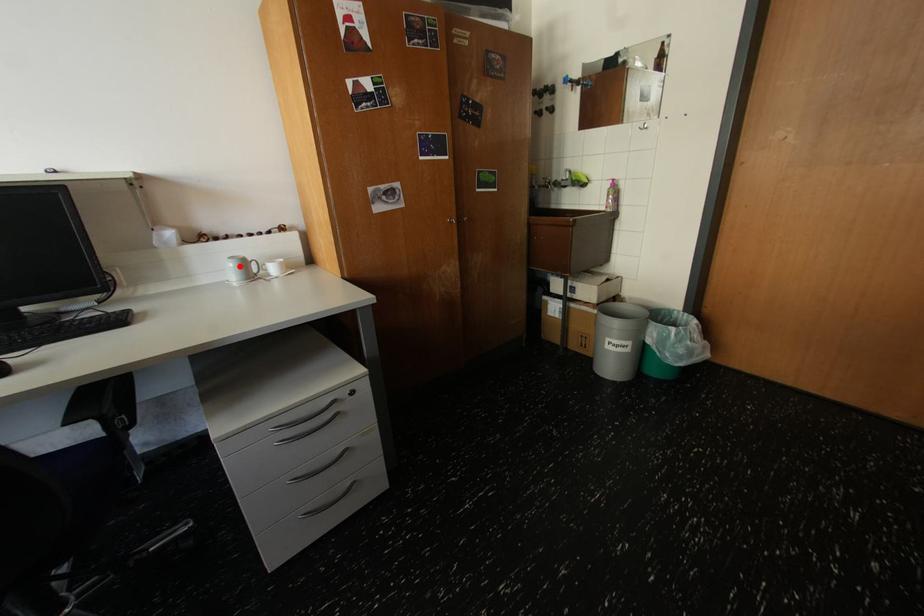
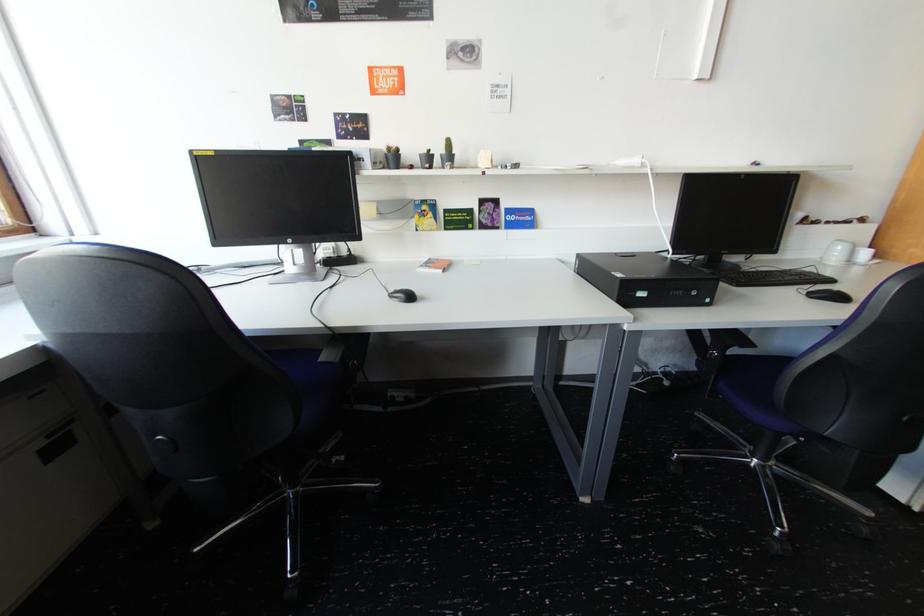
Question: I am providing you with two images of the same scene from different viewpoints. A red point is shown in image1. For the corresponding object point in image2, is it positioned nearer or farther from the camera?

Choices:
 (A) Nearer
 (B) Farther

Answer: (B)